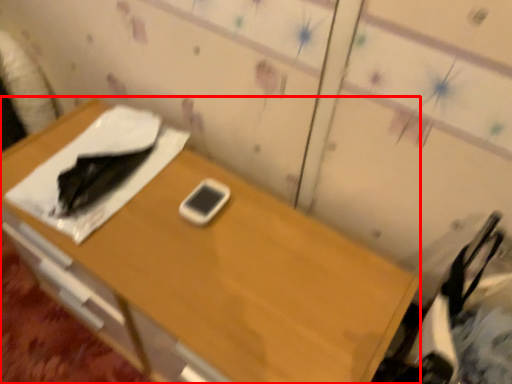
Question: From the image's perspective, considering the relative positions of desk (annotated by the red box) and mobile phone in the image provided, where is desk (annotated by the red box) located with respect to the staircase?

Choices:
 (A) below
 (B) above

Answer: (A)